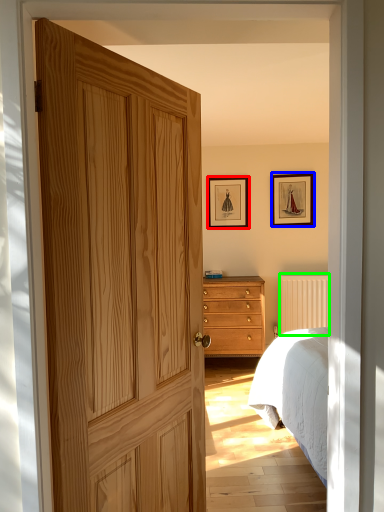
Question: Which object is positioned closest to picture frame (highlighted by a red box)? Select from picture frame (highlighted by a blue box) and radiator (highlighted by a green box).

Choices:
 (A) picture frame
 (B) radiator

Answer: (A)